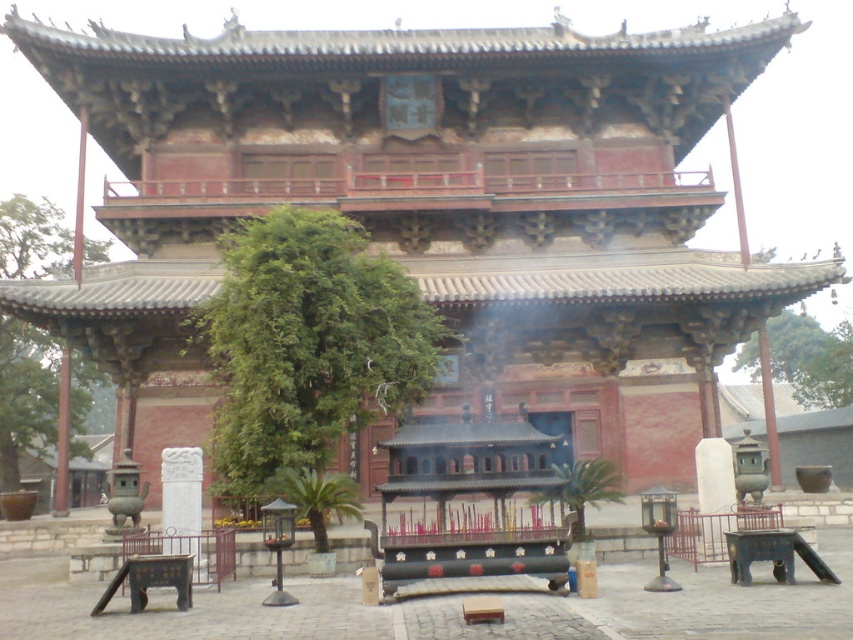
You are standing in front of the traditional Chinese building and see a point marked at coordinates (25, 394). What object is located at that point?

The point at coordinates (25, 394) corresponds to the green leafy tree at left.